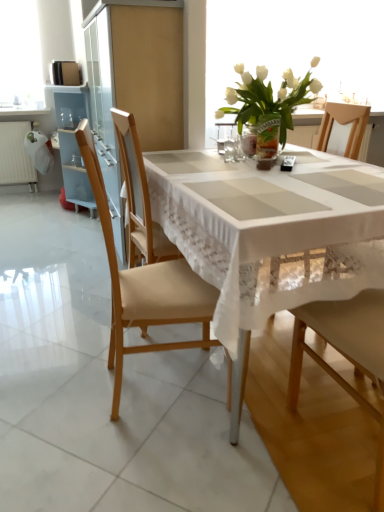
Locate an element on the screen. vacant space to the right of translucent glass vase at center, which is counted as the 1th tableware, starting from the left is located at coordinates (275, 160).